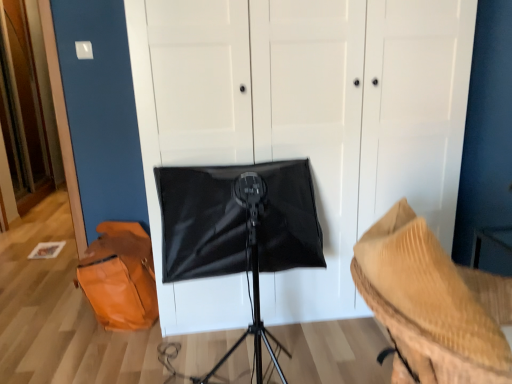
Question: Is black matte softbox at center facing away from orange leather messenger bag at lower left?

Choices:
 (A) no
 (B) yes

Answer: (A)

Question: Is black matte softbox at center surrounding orange leather messenger bag at lower left?

Choices:
 (A) no
 (B) yes

Answer: (A)

Question: From a real-world perspective, is black matte softbox at center positioned over orange leather messenger bag at lower left based on gravity?

Choices:
 (A) no
 (B) yes

Answer: (B)

Question: Does black matte softbox at center have a larger size compared to orange leather messenger bag at lower left?

Choices:
 (A) yes
 (B) no

Answer: (A)

Question: Is black matte softbox at center at the right side of orange leather messenger bag at lower left?

Choices:
 (A) yes
 (B) no

Answer: (A)

Question: Does black matte softbox at center come in front of orange leather messenger bag at lower left?

Choices:
 (A) no
 (B) yes

Answer: (B)

Question: Does orange leather messenger bag at lower left appear on the left side of black matte softbox at center?

Choices:
 (A) no
 (B) yes

Answer: (B)

Question: From the image's perspective, is orange leather messenger bag at lower left below black matte softbox at center?

Choices:
 (A) yes
 (B) no

Answer: (A)

Question: Does orange leather messenger bag at lower left have a lesser width compared to black matte softbox at center?

Choices:
 (A) yes
 (B) no

Answer: (A)

Question: Is orange leather messenger bag at lower left taller than black matte softbox at center?

Choices:
 (A) yes
 (B) no

Answer: (B)

Question: Would you say black matte softbox at center is part of orange leather messenger bag at lower left's contents?

Choices:
 (A) no
 (B) yes

Answer: (A)

Question: Would you say orange leather messenger bag at lower left is outside black matte softbox at center?

Choices:
 (A) yes
 (B) no

Answer: (A)

Question: From the image's perspective, is rippled beige fabric at lower right located above orange leather messenger bag at lower left?

Choices:
 (A) no
 (B) yes

Answer: (A)